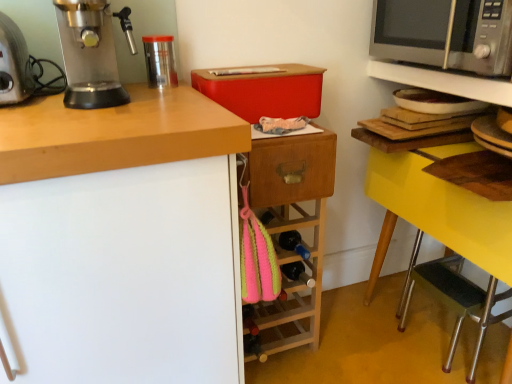
You are a GUI agent. You are given a task and a screenshot of the screen. Output one action in this format:
    pyautogui.click(x=<x>, y=<y>)
    Task: Click on the vacant region to the left of black rubber step stool at lower right
    
    Given the screenshot: What is the action you would take?
    (x=357, y=336)